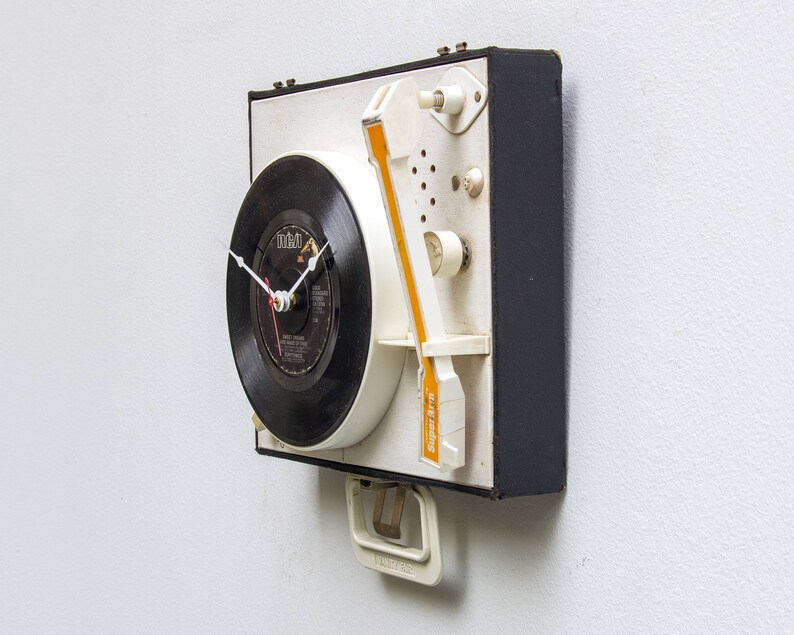
This screenshot has width=794, height=635. Identify the location of wall. (129, 283), (683, 224).